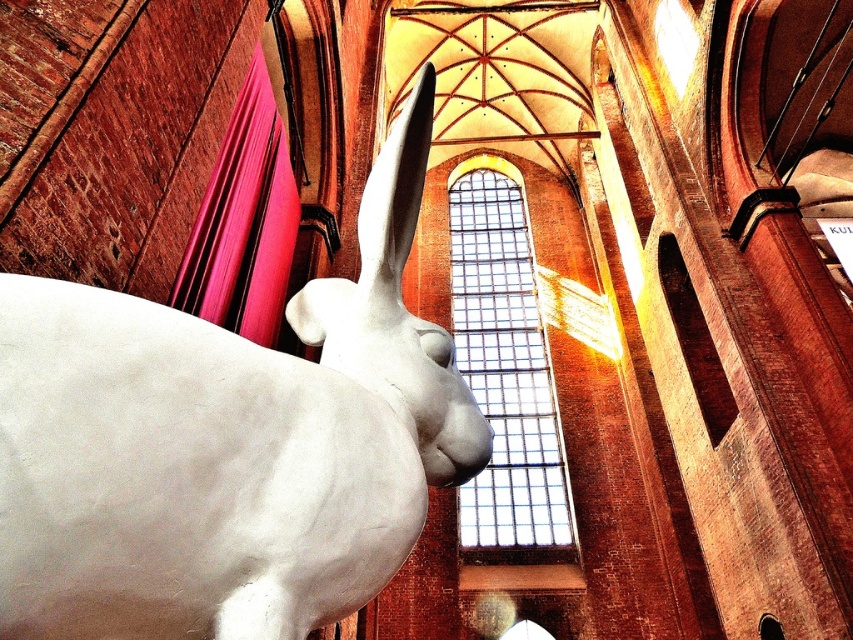
Question: From the image, what is the correct spatial relationship of white glossy sculpture at left in relation to clear glass window at center?

Choices:
 (A) below
 (B) above

Answer: (A)

Question: Does white glossy sculpture at left have a smaller size compared to matte pink fabric at left?

Choices:
 (A) yes
 (B) no

Answer: (B)

Question: Is white glossy sculpture at left smaller than clear glass window at center?

Choices:
 (A) yes
 (B) no

Answer: (A)

Question: Which of the following is the farthest from the observer?

Choices:
 (A) (27, 314)
 (B) (273, 120)

Answer: (B)

Question: Which point is closer to the camera?

Choices:
 (A) clear glass window at center
 (B) matte pink fabric at left

Answer: (B)

Question: Based on their relative distances, which object is farther from the white glossy sculpture at left?

Choices:
 (A) clear glass window at center
 (B) matte pink fabric at left

Answer: (A)